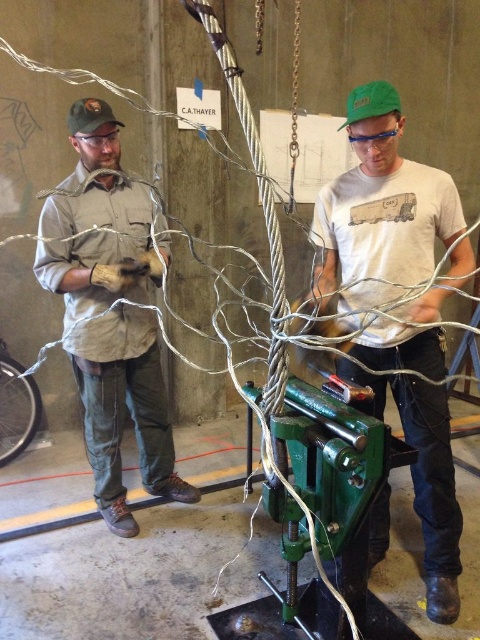
Question: Does white matte t-shirt at center appear over matte khaki shirt at left?

Choices:
 (A) yes
 (B) no

Answer: (B)

Question: Is white matte t-shirt at center closer to the viewer compared to matte khaki shirt at left?

Choices:
 (A) yes
 (B) no

Answer: (A)

Question: Can you confirm if white matte t-shirt at center is smaller than matte khaki shirt at left?

Choices:
 (A) yes
 (B) no

Answer: (B)

Question: Which of the following is the farthest from the observer?

Choices:
 (A) matte khaki shirt at left
 (B) white matte t-shirt at center

Answer: (A)

Question: Which point is closer to the camera?

Choices:
 (A) (155, 460)
 (B) (416, 333)

Answer: (B)